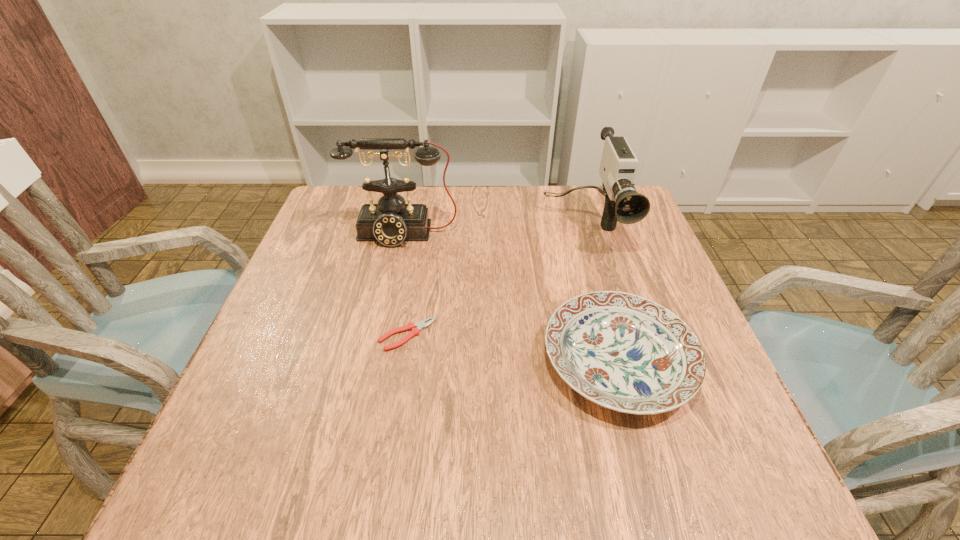
Where is `object located at the left edge`? This screenshot has width=960, height=540. object located at the left edge is located at coordinates (391, 222).

Find the location of a particular element. camcorder that is at the right edge is located at coordinates (623, 203).

Image resolution: width=960 pixels, height=540 pixels. What are the coordinates of `plate present at the right edge` in the screenshot? It's located at (624, 352).

You are a GUI agent. You are given a task and a screenshot of the screen. Output one action in this format:
    pyautogui.click(x=<x>, y=<y>)
    Task: Click on the object at the far left corner
    
    Given the screenshot: What is the action you would take?
    [391, 222]

Locate an element on the screen. This screenshot has height=540, width=960. object that is at the far right corner is located at coordinates (623, 203).

This screenshot has width=960, height=540. What are the coordinates of `free region at the far edge` in the screenshot? It's located at (565, 185).

Locate an element on the screen. This screenshot has width=960, height=540. vacant space at the near edge of the desktop is located at coordinates (619, 496).

Identify the location of vacant space at the left edge of the desktop. This screenshot has width=960, height=540. (235, 387).

Locate an element on the screen. free point at the right edge is located at coordinates (611, 237).

Identify the location of vacant region at the near left corner of the desktop. (248, 464).